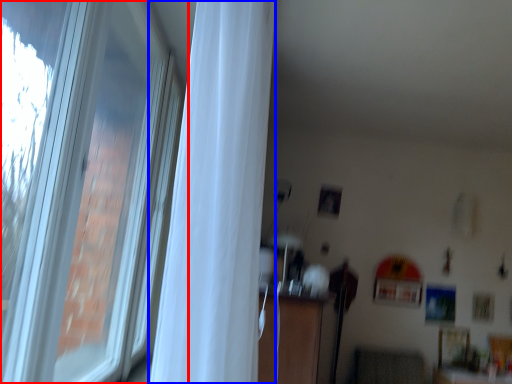
Question: Which object is further to the camera taking this photo, window (highlighted by a red box) or curtain (highlighted by a blue box)?

Choices:
 (A) window
 (B) curtain

Answer: (B)